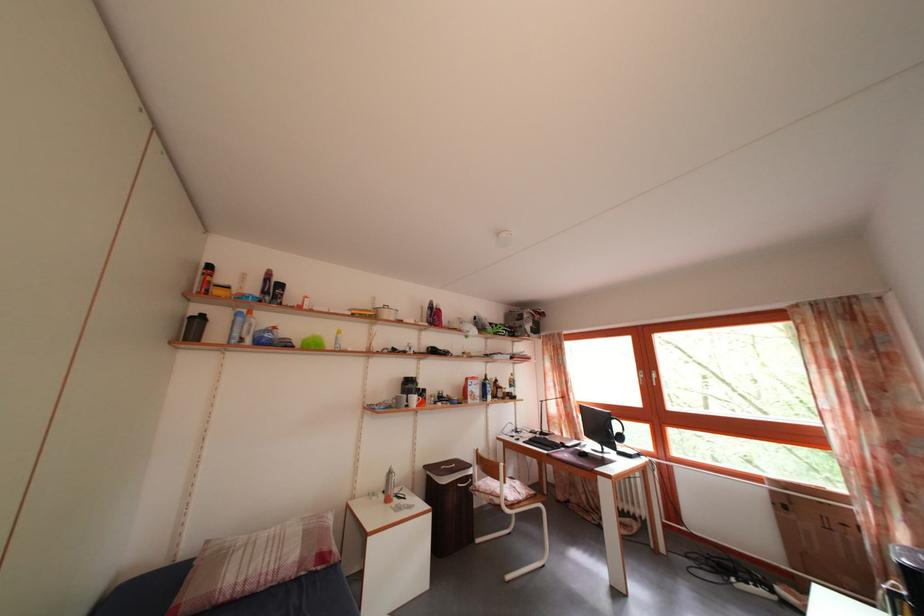
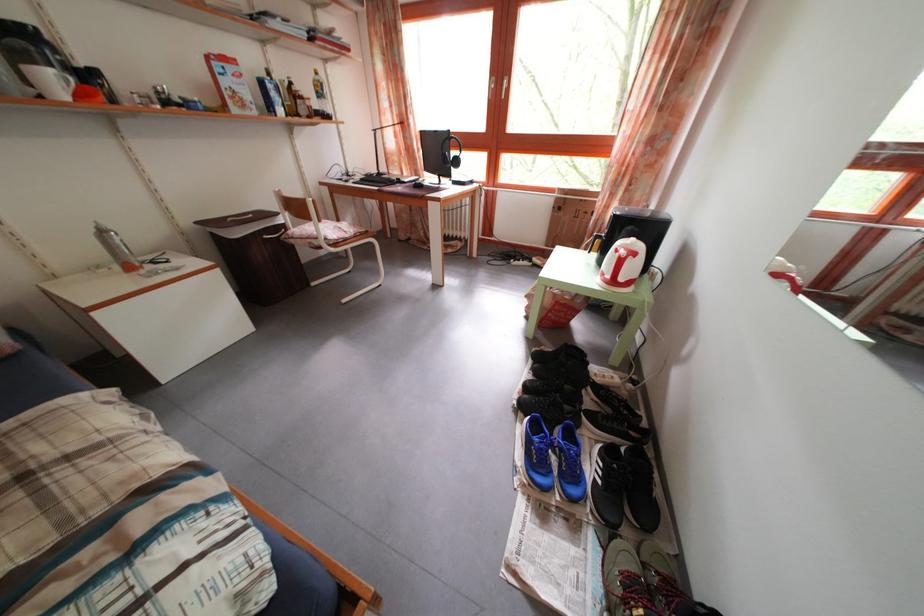
The point at (606, 431) is marked in the first image. Where is the corresponding point in the second image?

(446, 160)